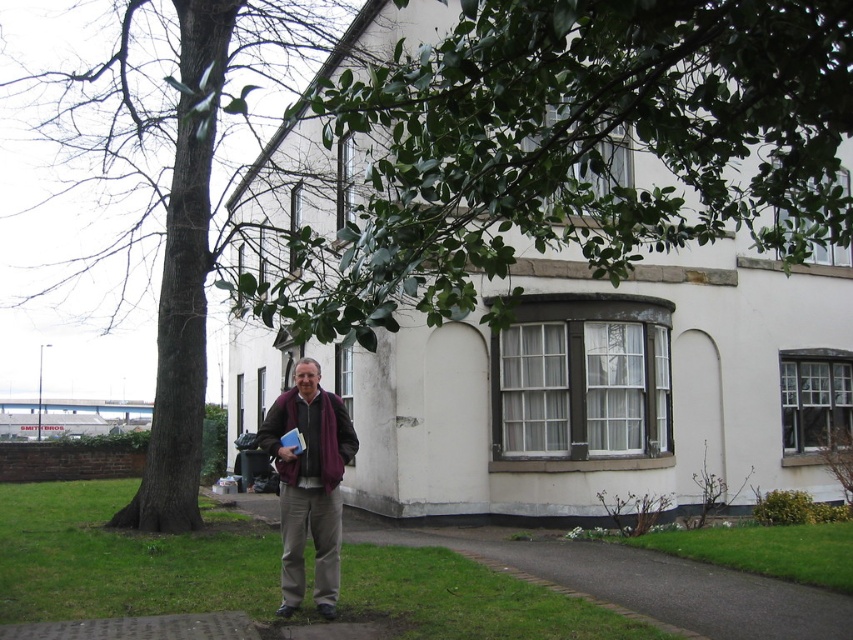
Question: Observing the image, what is the correct spatial positioning of green leafy tree at center in reference to maroon wool scarf at center?

Choices:
 (A) above
 (B) below

Answer: (A)

Question: Which is nearer to the maroon wool scarf at center?

Choices:
 (A) green leafy branch at upper center
 (B) green leafy tree at center

Answer: (A)

Question: Considering the real-world distances, which object is farthest from the green leafy branch at upper center?

Choices:
 (A) maroon wool scarf at center
 (B) green leafy tree at center

Answer: (A)

Question: Which of these objects is positioned farthest from the green leafy tree at center?

Choices:
 (A) maroon wool scarf at center
 (B) green leafy branch at upper center

Answer: (A)

Question: Does green leafy tree at center appear under maroon wool scarf at center?

Choices:
 (A) yes
 (B) no

Answer: (B)

Question: Does green leafy tree at center have a lesser width compared to maroon wool scarf at center?

Choices:
 (A) no
 (B) yes

Answer: (A)